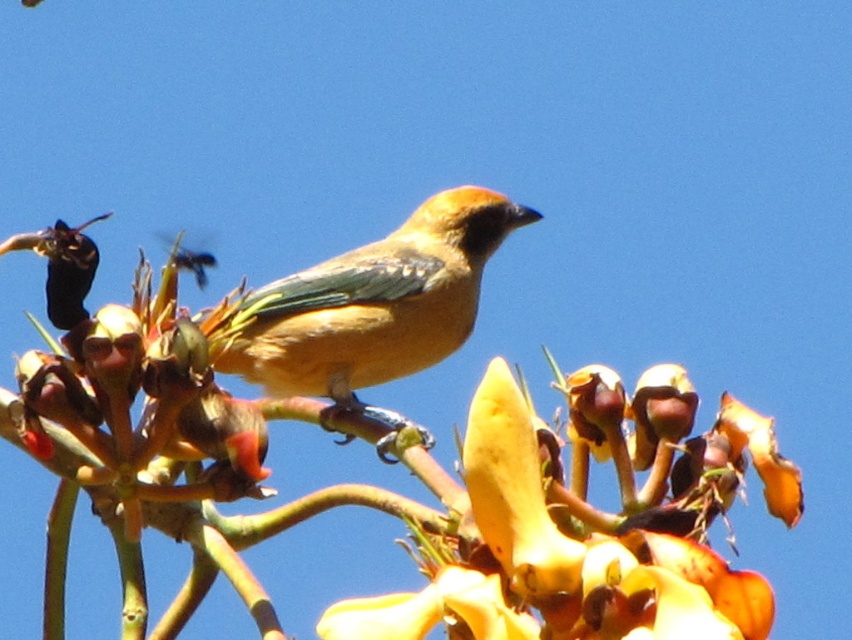
You are looking at the image and want to determine which of the two points, point (101, 502) or point (436, 308), is nearer to you. Based on the description, which point is closer?

Point (101, 502) is closer to the camera than point (436, 308).

You are a photographer trying to capture the matte orange bird at center and the smooth yellow flower at center in a single shot. Based on their positions, which one will appear closer to the camera?

The smooth yellow flower at center is taller than the matte orange bird at center, so it will appear closer to the camera.

You are a photographer aiming to capture the matte orange bird at center and the yellow papery flower at center in a single frame. Based on their positions, which one should you focus on first to ensure both are in focus?

The yellow papery flower at center is located below the matte orange bird at center. To ensure both are in focus, you should focus on the matte orange bird at center first since it is higher up and the depth of field will naturally include the flower below it.